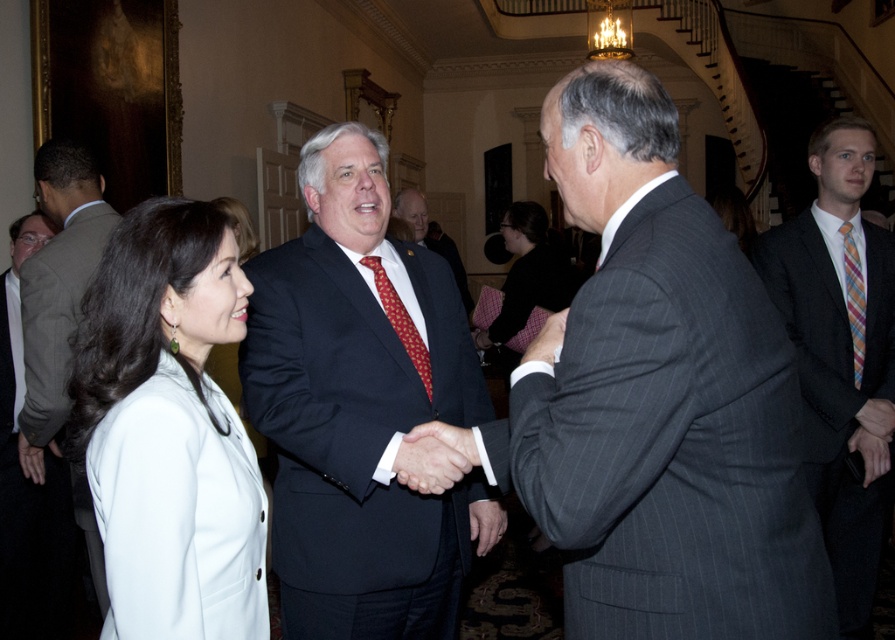
Question: Is gray pinstripe suit at center further to the viewer compared to plaid silk tie at right?

Choices:
 (A) yes
 (B) no

Answer: (B)

Question: Which point is closer to the camera taking this photo?

Choices:
 (A) (118, 531)
 (B) (241, 348)
 (C) (546, 228)
 (D) (847, 289)

Answer: (A)

Question: Which object is closer to the camera taking this photo?

Choices:
 (A) gray pinstripe suit at center
 (B) plaid silk tie at right

Answer: (A)

Question: Does gray pinstripe suit at center have a lesser width compared to orange striped tie at right?

Choices:
 (A) yes
 (B) no

Answer: (B)

Question: Can you confirm if dark blue suit at center is smaller than dark suit at center?

Choices:
 (A) yes
 (B) no

Answer: (A)

Question: Estimate the real-world distances between objects in this image. Which object is closer to the white fabric coat at left?

Choices:
 (A) plaid silk tie at right
 (B) dark gray suit at left

Answer: (B)